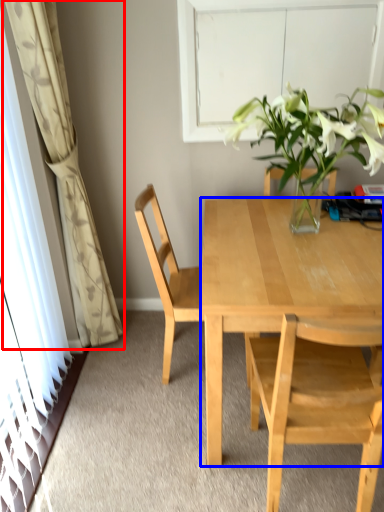
Question: Which object is further to the camera taking this photo, curtain (highlighted by a red box) or desk (highlighted by a blue box)?

Choices:
 (A) curtain
 (B) desk

Answer: (A)